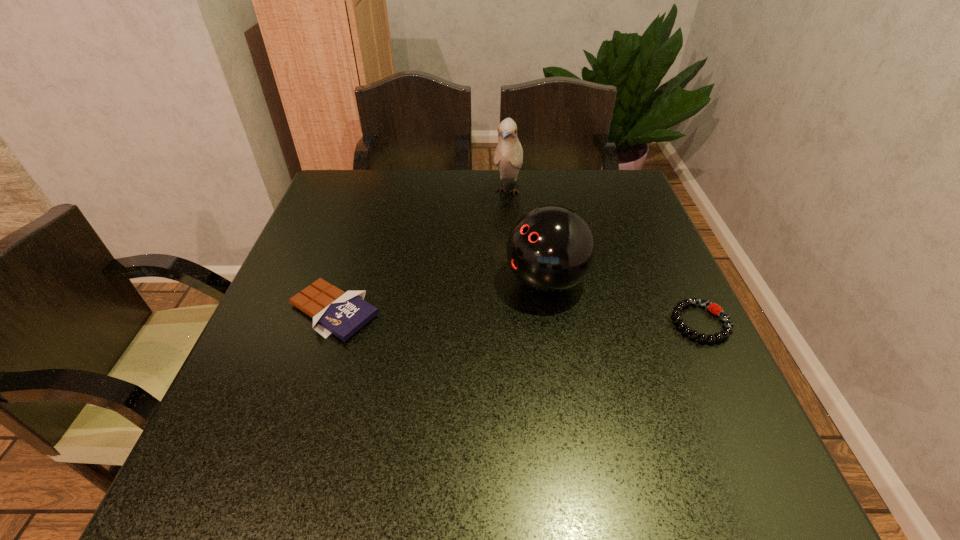
Image resolution: width=960 pixels, height=540 pixels. Identify the location of the leftmost object. (333, 311).

Locate an element on the screen. The width and height of the screenshot is (960, 540). the second shortest object is located at coordinates (333, 311).

Identify the location of bracelet. This screenshot has width=960, height=540. (712, 307).

The width and height of the screenshot is (960, 540). I want to click on the shortest object, so click(712, 307).

At what (x,y) coordinates should I click in order to perform the action: click on bowling ball. Please return your answer as a coordinate pair (x, y). Looking at the image, I should click on (551, 249).

Locate an element on the screen. The image size is (960, 540). the farthest object is located at coordinates (508, 156).

Where is `the tallest object`? the tallest object is located at coordinates tap(508, 156).

What are the coordinates of `vacant space located 0.180m on the right of the second shortest object` in the screenshot? It's located at (464, 311).

Identify the location of vacant area situated 0.120m on the front of the rightmost object. This screenshot has height=540, width=960. (737, 399).

Locate an element on the screen. The height and width of the screenshot is (540, 960). vacant space located on the surface of the bowling ball near the finger holes is located at coordinates (376, 356).